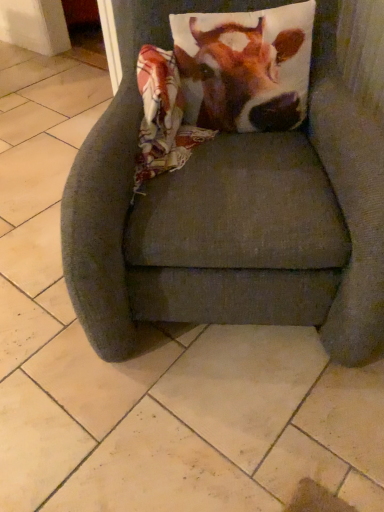
This screenshot has width=384, height=512. Find the location of `cow print pillow at upper center`. cow print pillow at upper center is located at coordinates (244, 68).

Describe the element at coordinates (244, 68) in the screenshot. I see `cow print pillow at upper center` at that location.

Identify the location of dark gray fabric chair at center. (231, 212).

The image size is (384, 512). What do you see at coordinates (231, 212) in the screenshot?
I see `dark gray fabric chair at center` at bounding box center [231, 212].

This screenshot has width=384, height=512. Identify the location of cow print pillow at upper center. (244, 68).

Considering the relative positions of cow print pillow at upper center and dark gray fabric chair at center in the image provided, is cow print pillow at upper center to the right of dark gray fabric chair at center from the viewer's perspective?

Yes.

Considering the relative positions of cow print pillow at upper center and dark gray fabric chair at center in the image provided, is cow print pillow at upper center in front of dark gray fabric chair at center?

No, the depth of cow print pillow at upper center is greater than that of dark gray fabric chair at center.

Does point (228, 121) come closer to viewer compared to point (126, 222)?

No, it is behind (126, 222).

From the image's perspective, does cow print pillow at upper center appear lower than dark gray fabric chair at center?

Incorrect, from the image's perspective, cow print pillow at upper center is higher than dark gray fabric chair at center.

From a real-world perspective, is cow print pillow at upper center located higher than dark gray fabric chair at center?

Yes, from a real-world perspective, cow print pillow at upper center is over dark gray fabric chair at center

Considering the sizes of cow print pillow at upper center and dark gray fabric chair at center in the image, is cow print pillow at upper center wider or thinner than dark gray fabric chair at center?

cow print pillow at upper center is thinner than dark gray fabric chair at center.

Considering the relative sizes of cow print pillow at upper center and dark gray fabric chair at center in the image provided, is cow print pillow at upper center shorter than dark gray fabric chair at center?

Yes, cow print pillow at upper center is shorter than dark gray fabric chair at center.

Considering the sizes of objects cow print pillow at upper center and dark gray fabric chair at center in the image provided, who is bigger, cow print pillow at upper center or dark gray fabric chair at center?

Bigger between the two is dark gray fabric chair at center.

In the scene shown: Is cow print pillow at upper center inside or outside of dark gray fabric chair at center?

cow print pillow at upper center can be found inside dark gray fabric chair at center.

Is cow print pillow at upper center beside dark gray fabric chair at center?

cow print pillow at upper center and dark gray fabric chair at center are not in contact.

Is cow print pillow at upper center looking in the opposite direction of dark gray fabric chair at center?

→ Yes, cow print pillow at upper center is positioned with its back facing dark gray fabric chair at center.

Consider the image. What's the angular difference between cow print pillow at upper center and dark gray fabric chair at center's facing directions?

The facing directions of cow print pillow at upper center and dark gray fabric chair at center are 0.442 degrees apart.

Where is `chair below the cow print pillow at upper center (from a real-world perspective)`? This screenshot has height=512, width=384. chair below the cow print pillow at upper center (from a real-world perspective) is located at coordinates (231, 212).

Based on the photo, does dark gray fabric chair at center appear on the right side of cow print pillow at upper center?

No.

From the picture: Which is in front, dark gray fabric chair at center or cow print pillow at upper center?

Positioned in front is dark gray fabric chair at center.

Is point (101, 259) positioned behind point (262, 69)?

No.

From the image's perspective, is dark gray fabric chair at center located above or below cow print pillow at upper center?

From the image's perspective, dark gray fabric chair at center appears below cow print pillow at upper center.

From a real-world perspective, who is located lower, dark gray fabric chair at center or cow print pillow at upper center?

From a 3D spatial view, dark gray fabric chair at center is below.

Can you confirm if dark gray fabric chair at center is thinner than cow print pillow at upper center?

No.

Is dark gray fabric chair at center shorter than cow print pillow at upper center?

No.

Consider the image. Does dark gray fabric chair at center have a smaller size compared to cow print pillow at upper center?

Incorrect, dark gray fabric chair at center is not smaller in size than cow print pillow at upper center.

Is dark gray fabric chair at center inside the boundaries of cow print pillow at upper center, or outside?

dark gray fabric chair at center cannot be found inside cow print pillow at upper center.

Are dark gray fabric chair at center and cow print pillow at upper center far apart?

No.

Could you tell me if dark gray fabric chair at center is facing cow print pillow at upper center?

Yes, dark gray fabric chair at center faces towards cow print pillow at upper center.

Measure the distance between dark gray fabric chair at center and cow print pillow at upper center.

dark gray fabric chair at center is 9.99 inches from cow print pillow at upper center.

Locate an element on the screen. The image size is (384, 512). chair below the cow print pillow at upper center (from a real-world perspective) is located at coordinates (231, 212).

Find the location of a particular element. cattle located on the right of dark gray fabric chair at center is located at coordinates (244, 68).

The width and height of the screenshot is (384, 512). I want to click on chair that is under the cow print pillow at upper center (from a real-world perspective), so click(x=231, y=212).